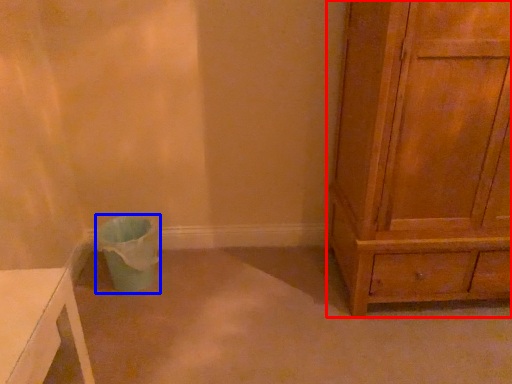
Question: Which object appears farthest to the camera in this image, chest of drawers (highlighted by a red box) or potty (highlighted by a blue box)?

Choices:
 (A) chest of drawers
 (B) potty

Answer: (B)